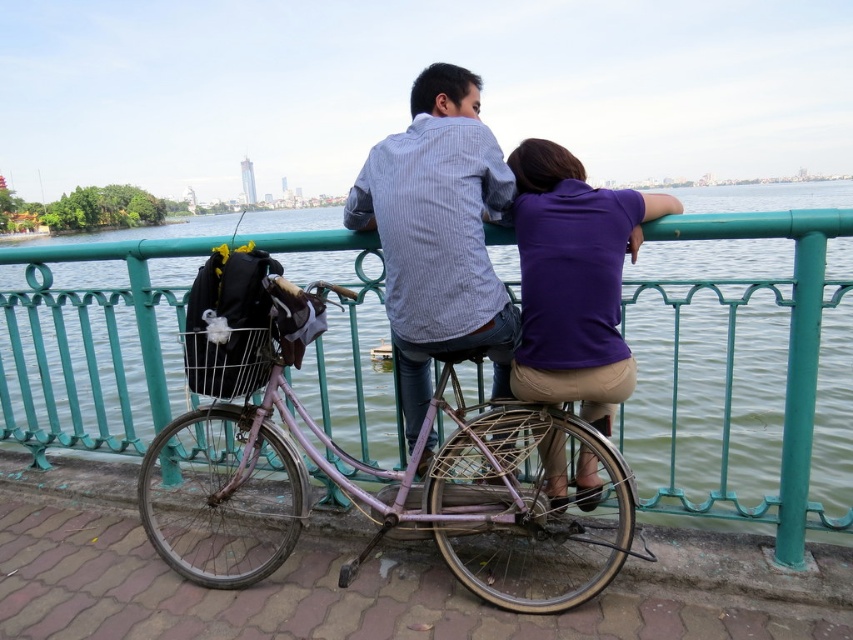
Question: Which point appears closest to the camera in this image?

Choices:
 (A) (515, 205)
 (B) (479, 435)
 (C) (788, 218)
 (D) (386, 163)

Answer: (C)

Question: Which is farther from the green metal railing at upper center?

Choices:
 (A) purple matte shirt at upper right
 (B) striped cotton shirt at center
 (C) purple matte bicycle at center

Answer: (B)

Question: Can you confirm if green metal railing at upper center is positioned above purple matte bicycle at center?

Choices:
 (A) no
 (B) yes

Answer: (B)

Question: Does green metal railing at upper center have a larger size compared to striped cotton shirt at center?

Choices:
 (A) no
 (B) yes

Answer: (B)

Question: Which object is the closest to the purple matte shirt at upper right?

Choices:
 (A) green metal railing at upper center
 (B) striped cotton shirt at center
 (C) purple matte bicycle at center

Answer: (B)

Question: Is the position of striped cotton shirt at center less distant than that of purple matte shirt at upper right?

Choices:
 (A) yes
 (B) no

Answer: (B)